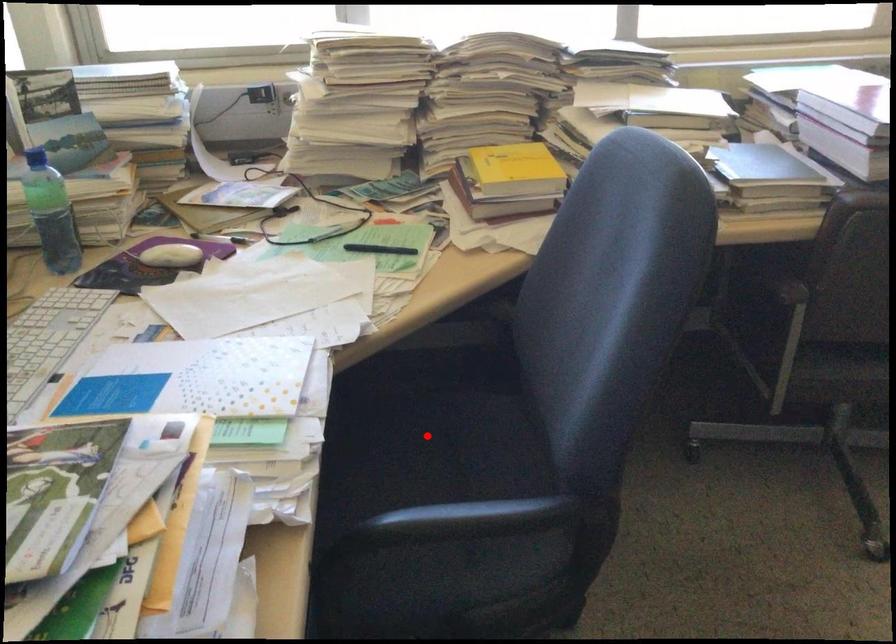
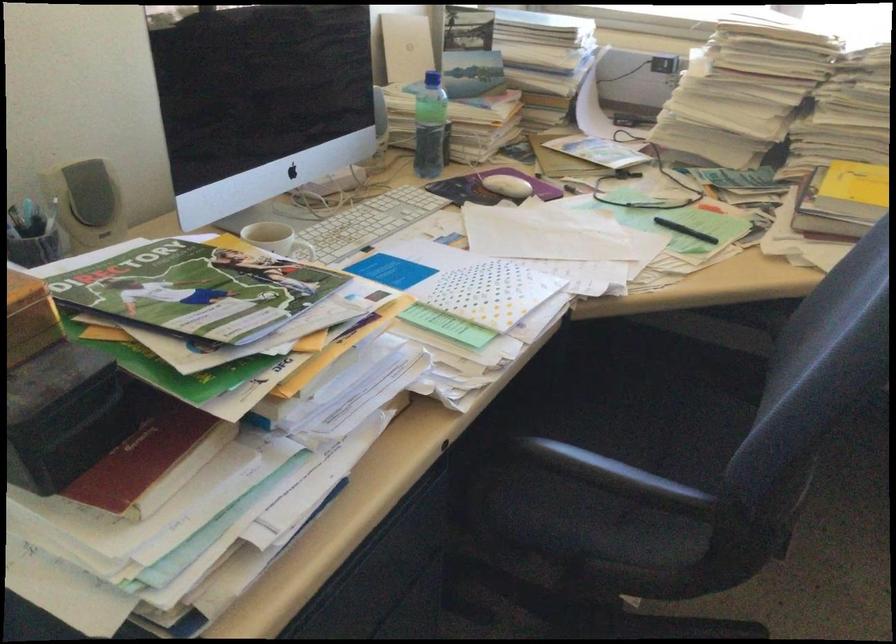
Where in the second image is the point corresponding to the highlighted location from the first image?

(653, 411)